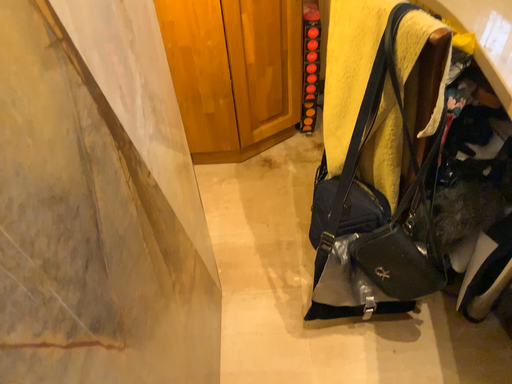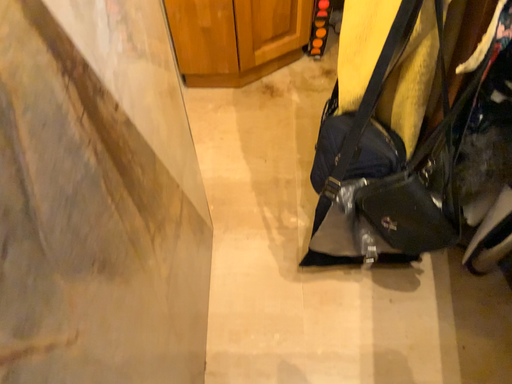
Question: How did the camera likely rotate when shooting the video?

Choices:
 (A) rotated downward
 (B) rotated upward

Answer: (A)